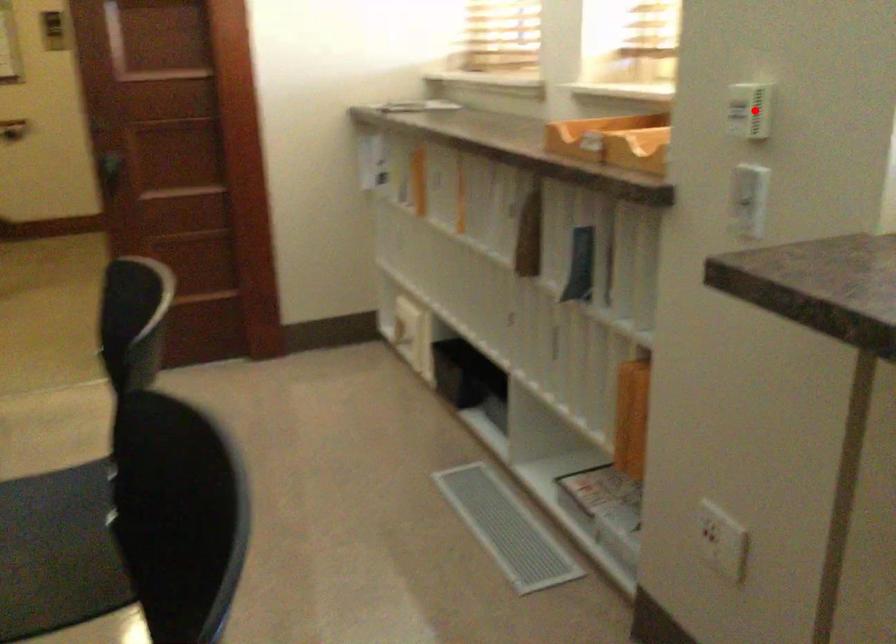
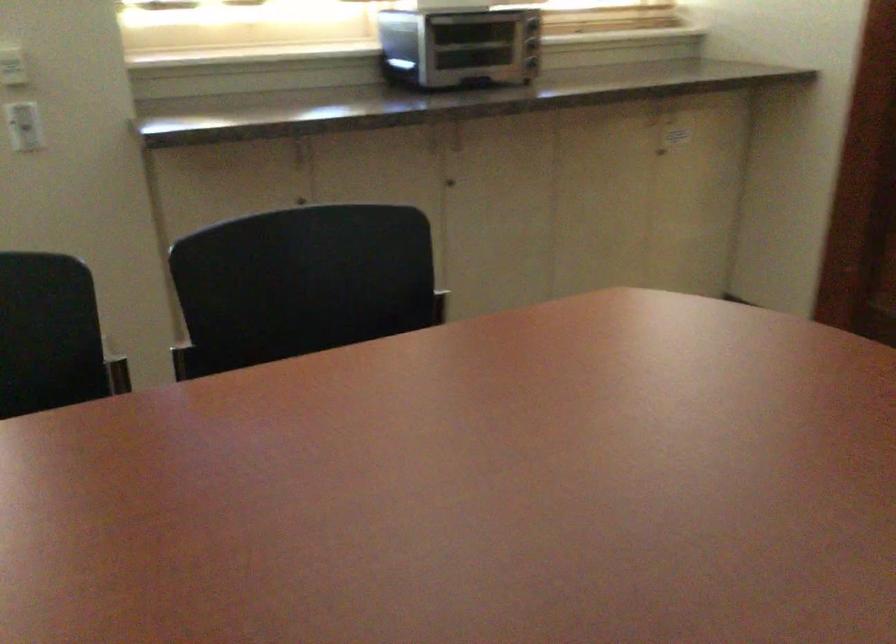
Question: I am providing you with two images of the same scene from different viewpoints. A red point is shown in image1. For the corresponding object point in image2, is it positioned nearer or farther from the camera?

Choices:
 (A) Nearer
 (B) Farther

Answer: (B)